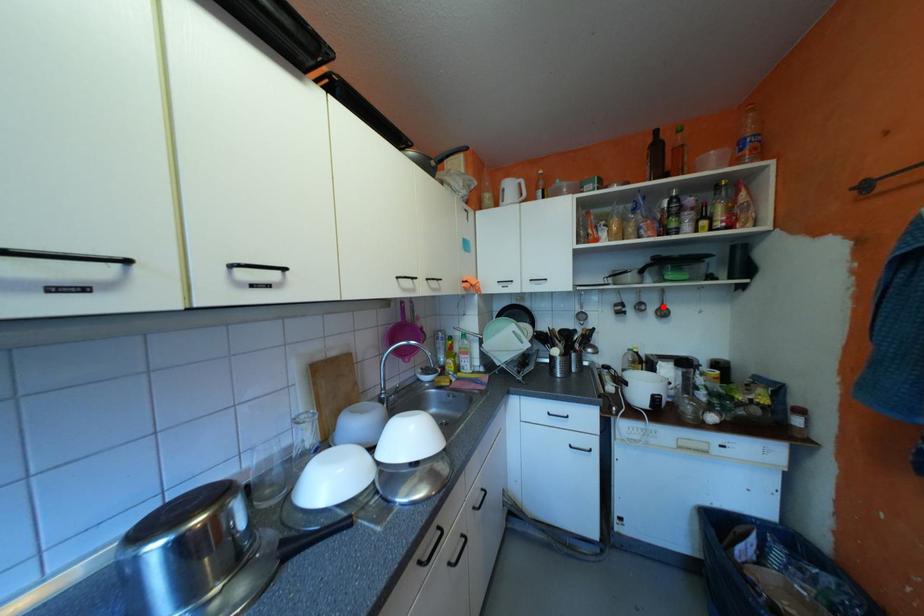
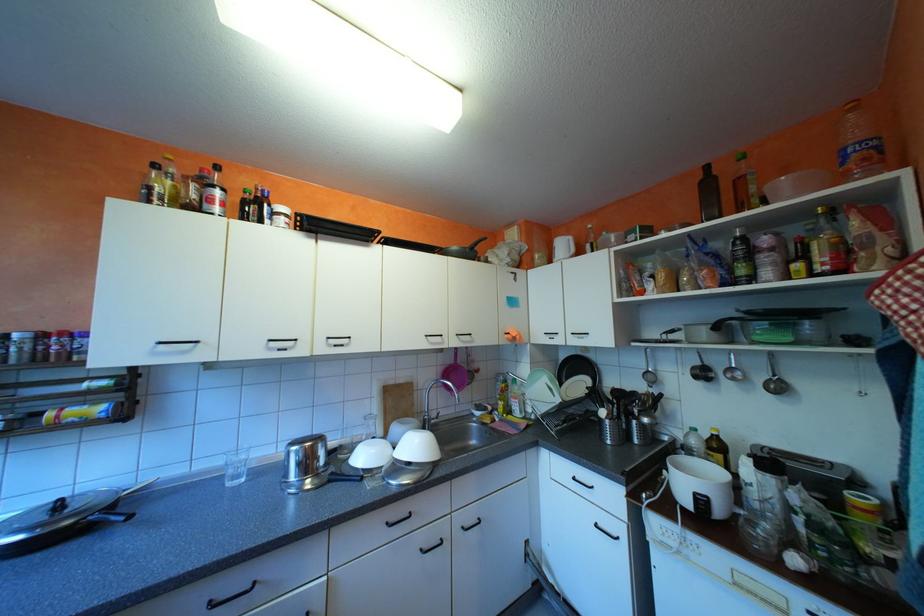
Locate, in the second image, the point that corresponds to the highlighted location in the first image.

(772, 377)